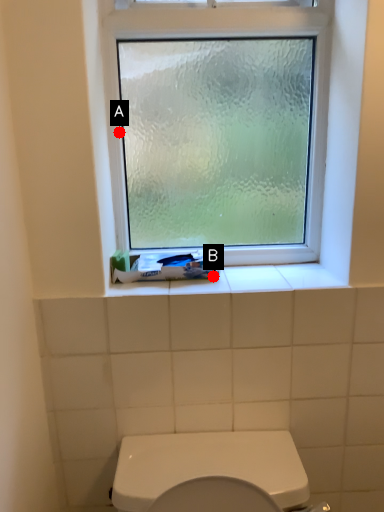
Question: Two points are circled on the image, labeled by A and B beside each circle. Which point appears farthest from the camera in this image?

Choices:
 (A) A is further
 (B) B is further

Answer: (A)